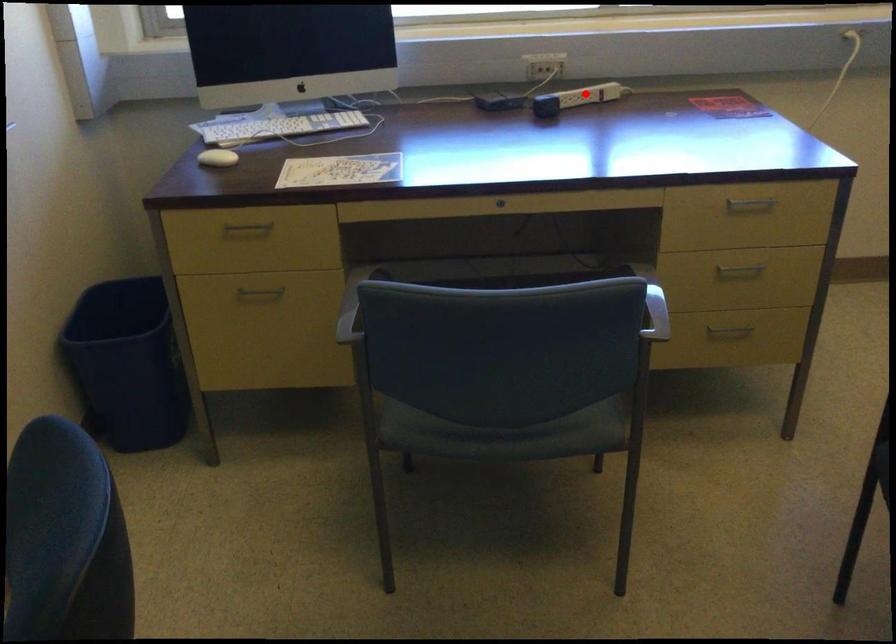
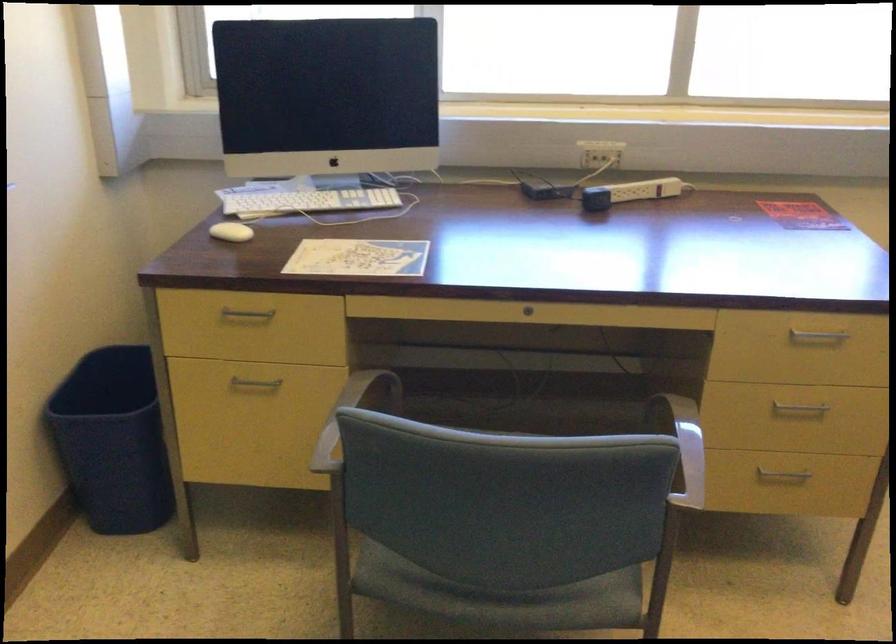
Locate, in the second image, the point that corresponds to the highlighted location in the first image.

(642, 190)